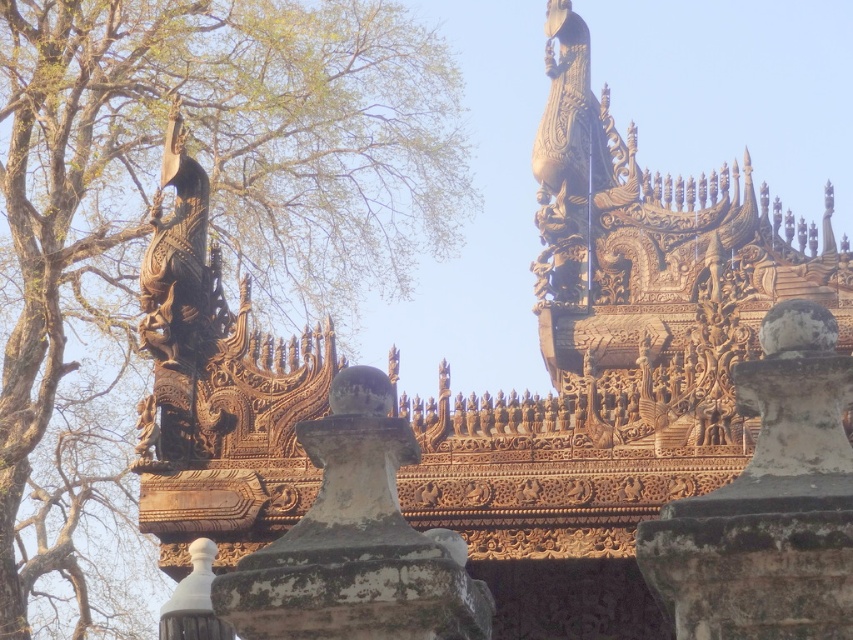
You are an architect analyzing the temple structure. You notice the green leafy tree at upper left and the white stone pillar at center. Which object is located higher in the image?

The green leafy tree at upper left is positioned over the white stone pillar at center, so it is higher.

What is located at the coordinates point (x=212, y=193) in the image?

The green leafy tree at upper left is located at point (x=212, y=193) in the image.